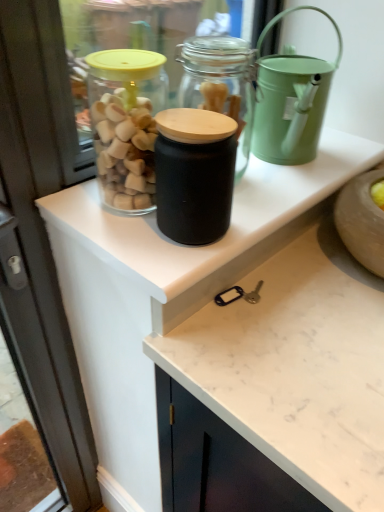
What do you see at coordinates (43, 236) in the screenshot? This screenshot has height=512, width=384. I see `transparent glass screen door at left` at bounding box center [43, 236].

In order to click on transparent glass screen door at left in this screenshot , I will do `click(43, 236)`.

Image resolution: width=384 pixels, height=512 pixels. I want to click on transparent glass screen door at left, so click(x=43, y=236).